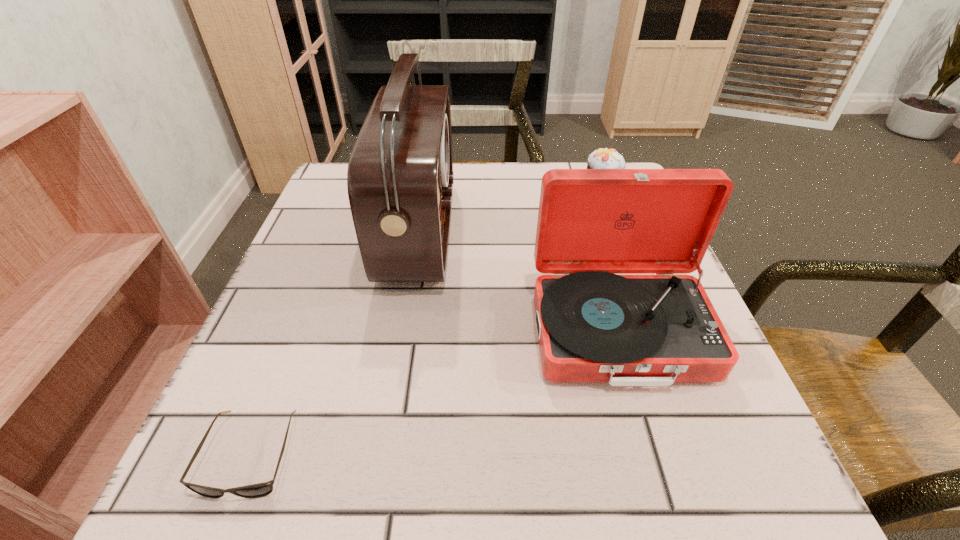
In order to click on the third object from right to left in this screenshot , I will do `click(400, 178)`.

You are a GUI agent. You are given a task and a screenshot of the screen. Output one action in this format:
    pyautogui.click(x=<x>, y=<y>)
    Task: Click on the tallest object
    
    Given the screenshot: What is the action you would take?
    pyautogui.click(x=400, y=178)

Locate an element on the screen. The width and height of the screenshot is (960, 540). phonograph_record is located at coordinates (593, 325).

Where is `the third tallest object`? This screenshot has height=540, width=960. the third tallest object is located at coordinates (601, 158).

Locate an element on the screen. Image resolution: width=960 pixels, height=540 pixels. the nearest object is located at coordinates (258, 490).

Locate an element on the screen. sunglasses is located at coordinates (258, 490).

Find the location of a particular element. The width and height of the screenshot is (960, 540). free space located on the front panel of the radio receiver is located at coordinates [555, 232].

What are the coordinates of `free space located 0.100m on the front-facing side of the phonograph_record` in the screenshot? It's located at (657, 459).

This screenshot has width=960, height=540. Find the location of `free space located on the front of the cupcake`. free space located on the front of the cupcake is located at coordinates (627, 251).

Identify the location of radio receiver located at the far edge. (400, 178).